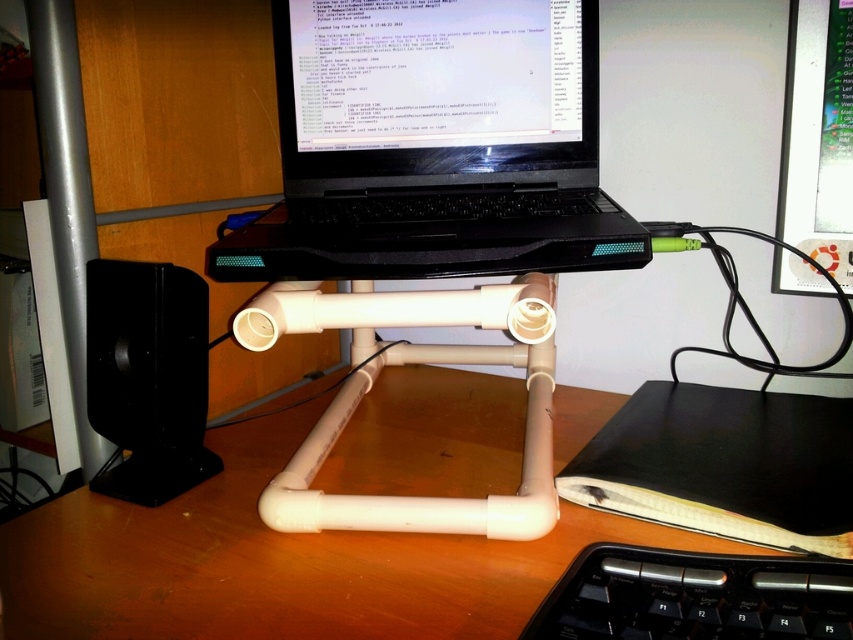
Can you confirm if white plastic table at center is positioned to the left of black glossy laptop at center?

Indeed, white plastic table at center is positioned on the left side of black glossy laptop at center.

Who is higher up, white plastic table at center or black glossy laptop at center?

black glossy laptop at center is higher up.

Between point (459, 548) and point (350, 86), which one is positioned behind?

Positioned behind is point (350, 86).

This screenshot has width=853, height=640. What are the coordinates of `white plastic table at center` in the screenshot? It's located at (280, 563).

From the picture: Does black glossy laptop at center have a lesser height compared to black plastic keyboard at lower right?

No.

Is black glossy laptop at center above black plastic keyboard at lower right?

Indeed, black glossy laptop at center is positioned over black plastic keyboard at lower right.

Between point (512, 38) and point (686, 589), which one is positioned behind?

Point (512, 38)

I want to click on black glossy laptop at center, so click(x=434, y=90).

Who is more distant from viewer, (608, 266) or (334, 88)?

The point (334, 88) is behind.

Does black plastic laptop at center have a smaller size compared to black glossy laptop at center?

Actually, black plastic laptop at center might be larger than black glossy laptop at center.

Is point (440, 241) positioned in front of point (344, 180)?

Yes, it is in front of point (344, 180).

Locate an element on the screen. The image size is (853, 640). black plastic laptop at center is located at coordinates (x=434, y=145).